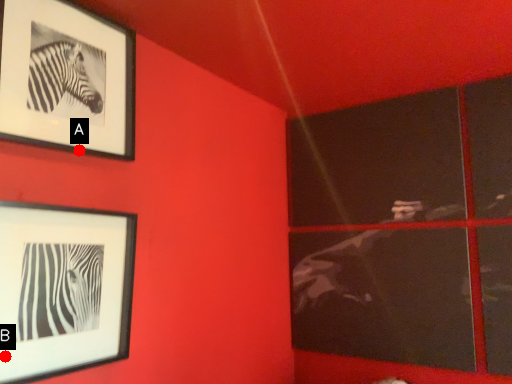
Question: Two points are circled on the image, labeled by A and B beside each circle. Which of the following is the closest to the observer?

Choices:
 (A) A is closer
 (B) B is closer

Answer: (B)